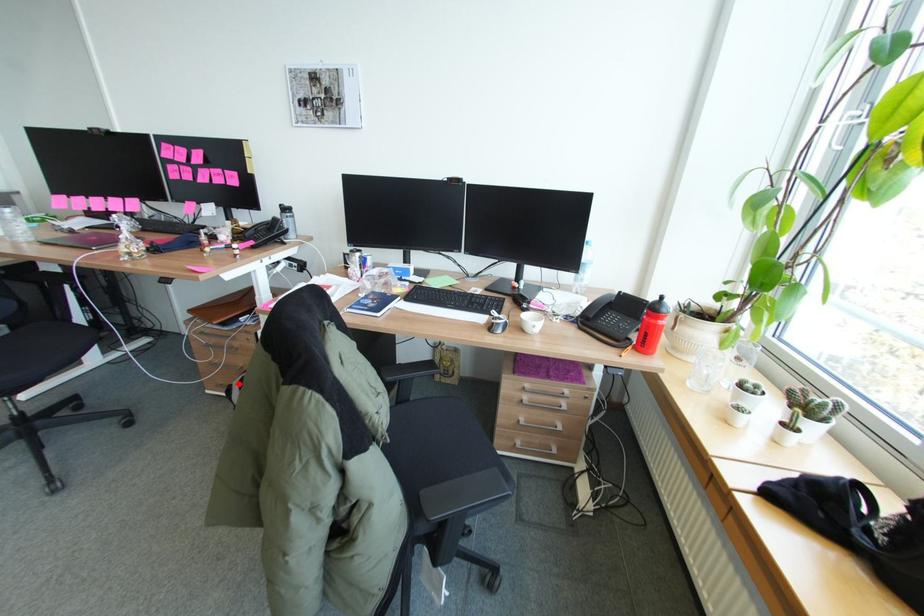
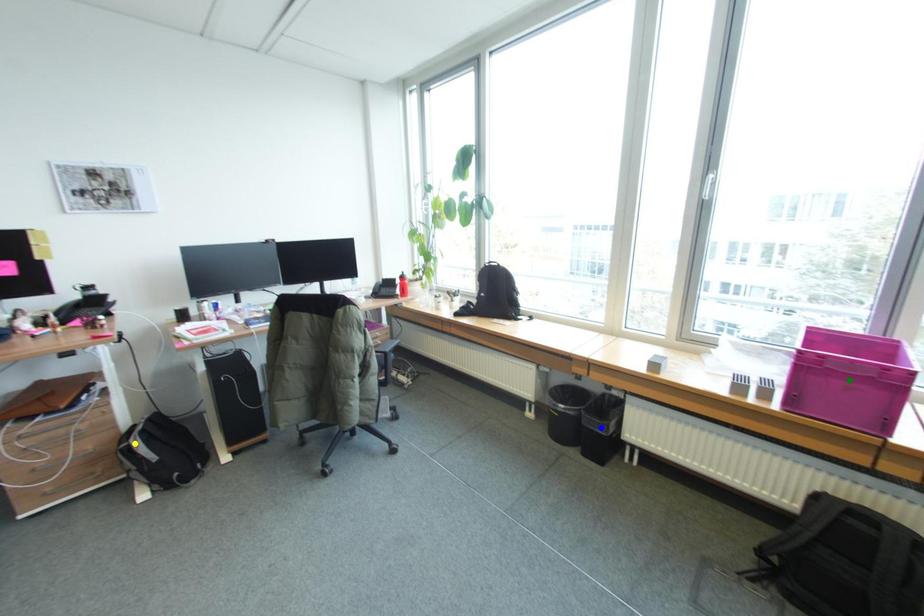
Question: I am providing you with two images of the same scene from different viewpoints. A red point is marked on the first image. You are given multiple points on the second image. Which mark in image 2 goes with the point in image 1?

Choices:
 (A) yellow point
 (B) blue point
 (C) green point

Answer: (A)